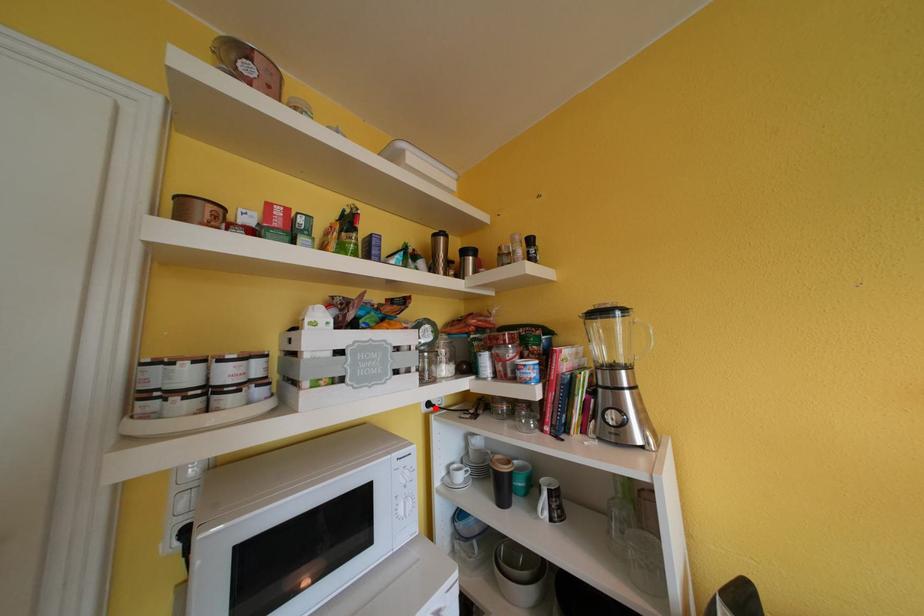
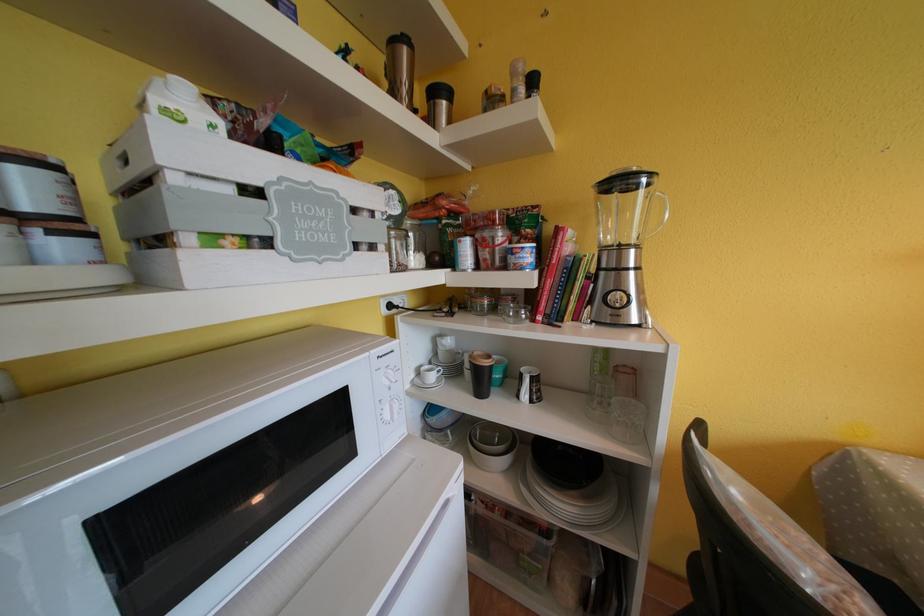
In the second image, find the point that corresponds to the highlighted location in the first image.

(396, 310)